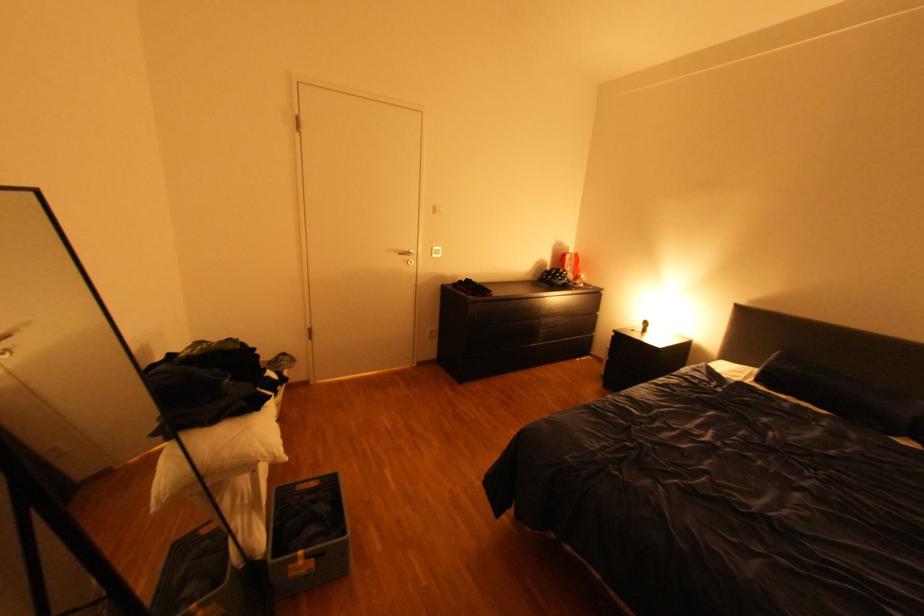
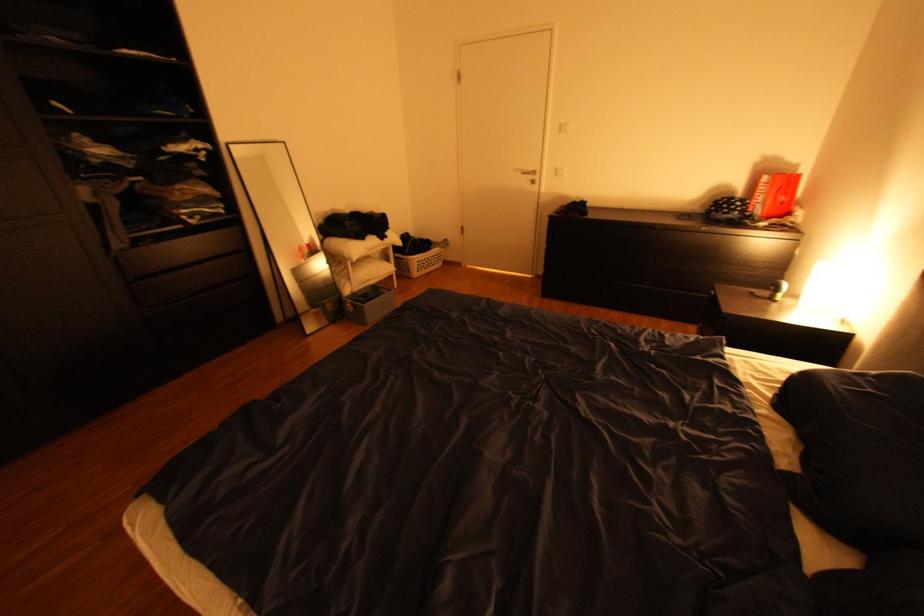
Where in the second image is the point corresponding to point 399,249 from the first image?

(526, 171)